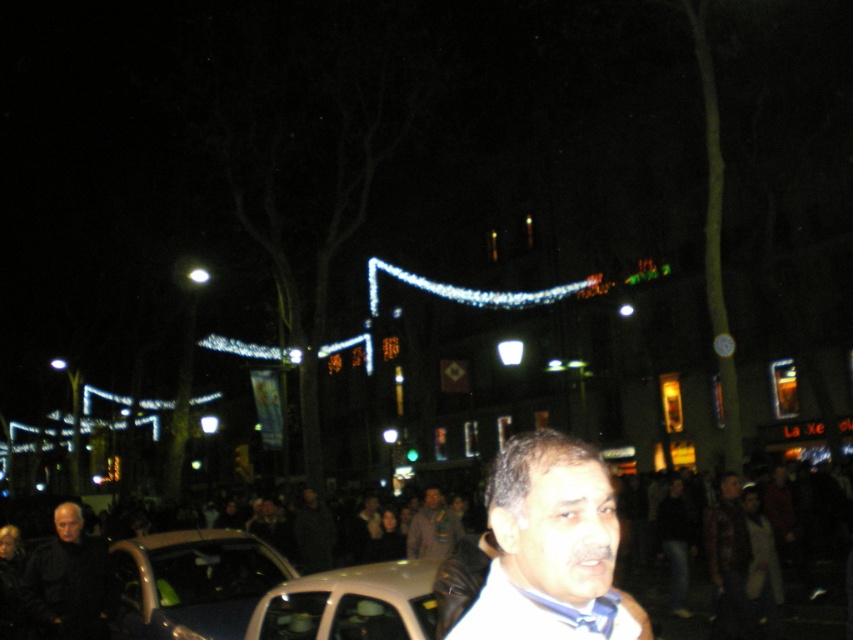
Between white matte jacket at center and matte beige car at lower center, which one has less height?

Standing shorter between the two is matte beige car at lower center.

Who is more forward, (436, 625) or (283, 634)?

Point (436, 625) is in front.

The image size is (853, 640). What are the coordinates of `white matte jacket at center` in the screenshot? It's located at (544, 548).

Which of these two, white satin shirt at lower center or blue silk tie at center, stands shorter?

With less height is blue silk tie at center.

Can you confirm if white satin shirt at lower center is positioned to the left of blue silk tie at center?

Correct, you'll find white satin shirt at lower center to the left of blue silk tie at center.

Between point (607, 595) and point (604, 593), which one is positioned in front?

Point (604, 593) is in front.

Locate an element on the screen. The height and width of the screenshot is (640, 853). white satin shirt at lower center is located at coordinates (543, 612).

Is metallic silver car at lower left bigger than matte beige car at lower center?

Correct, metallic silver car at lower left is larger in size than matte beige car at lower center.

Who is taller, metallic silver car at lower left or matte beige car at lower center?

Standing taller between the two is metallic silver car at lower left.

Does point (277, 556) lie behind point (386, 580)?

Yes, point (277, 556) is farther from viewer.

You are a GUI agent. You are given a task and a screenshot of the screen. Output one action in this format:
    pyautogui.click(x=<x>, y=<y>)
    Task: Click on the metallic silver car at lower left
    This screenshot has height=640, width=853.
    Given the screenshot: What is the action you would take?
    pyautogui.click(x=193, y=582)